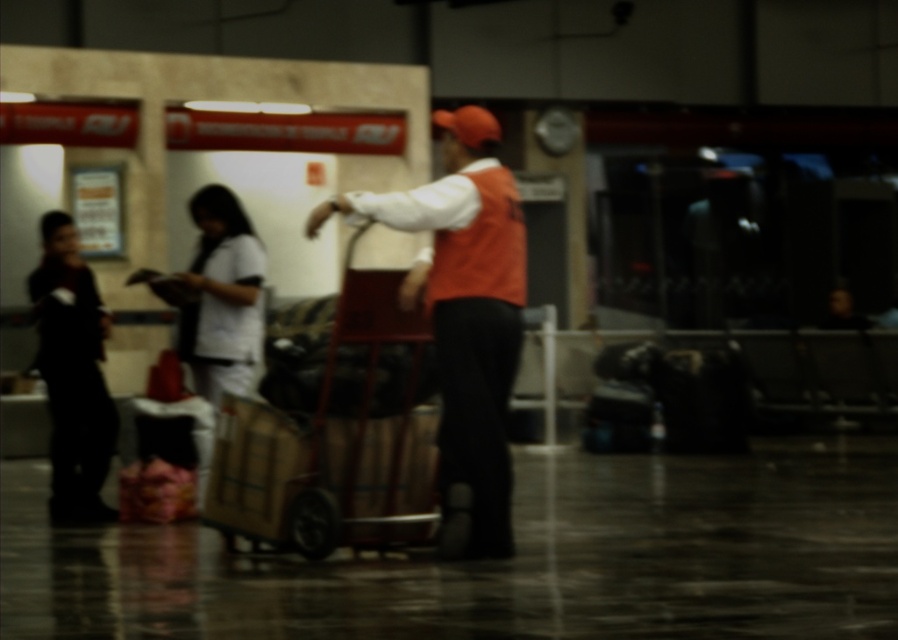
Does orange fabric vest at center have a lesser height compared to black matte jacket at left?

In fact, orange fabric vest at center may be taller than black matte jacket at left.

Between orange fabric vest at center and black matte jacket at left, which one has less height?

black matte jacket at left

Between point (511, 538) and point (91, 291), which one is positioned behind?

Point (91, 291)

You are a GUI agent. You are given a task and a screenshot of the screen. Output one action in this format:
    pyautogui.click(x=<x>, y=<y>)
    Task: Click on the orange fabric vest at center
    
    Given the screenshot: What is the action you would take?
    pyautogui.click(x=464, y=316)

Who is shorter, orange fabric vest at center or white cotton shirt at center?

With less height is white cotton shirt at center.

Is orange fabric vest at center below white cotton shirt at center?

Yes, orange fabric vest at center is below white cotton shirt at center.

Is point (497, 234) closer to viewer compared to point (197, 282)?

Yes, point (497, 234) is closer to viewer.

I want to click on orange fabric vest at center, so click(x=464, y=316).

Between point (500, 266) and point (392, 310), which one is positioned behind?

The point (392, 310) is behind.

Does orange fabric vest at center have a lesser height compared to wooden trolley at center?

No, orange fabric vest at center is not shorter than wooden trolley at center.

What do you see at coordinates (464, 316) in the screenshot?
I see `orange fabric vest at center` at bounding box center [464, 316].

At what (x,y) coordinates should I click in order to perform the action: click on orange fabric vest at center. Please return your answer as a coordinate pair (x, y). This screenshot has height=640, width=898. Looking at the image, I should click on (464, 316).